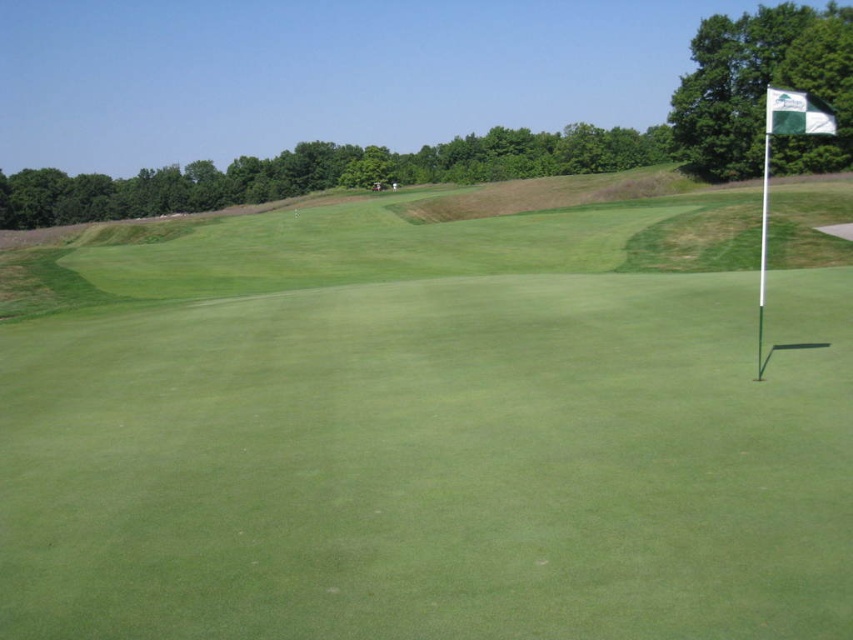
Consider the image. You are a golfer standing on the green grassy golf course at center. You see the green fabric flag at right. Which direction should you putt your ball to reach the flag?

You should putt your ball to the right, as the green grassy golf course at center is to the left of the green fabric flag at right. Since the flag is on the right side, putting the ball in that direction will move it towards the target.

You are standing at the edge of the green grassy golf course at center and want to putt a golf ball into the hole marked by the flagstick. The flagstick is 5 meters away from your current position. Can you reach the flagstick with a single putt without the ball rolling past it?

The green grassy golf course at center is 4.40 meters from the camera. Since the flagstick is 5 meters away from your current position, you can reach it with a single putt as the distance is within a typical putting range, but ensure you account for the slope and undulations of the green to prevent the ball from rolling past.